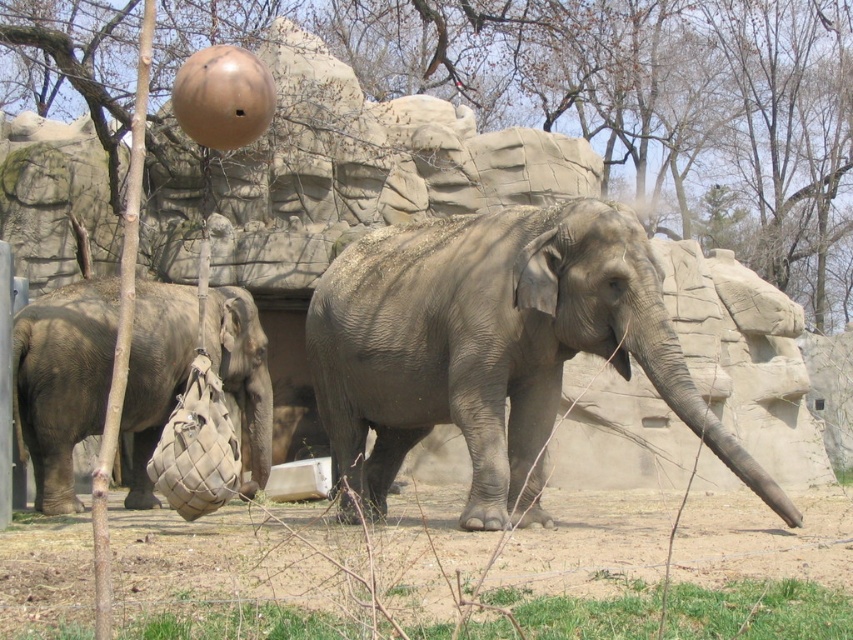
You are a zookeeper observing the elephants in their enclosure. You notice the gray matte elephant at center and the gray matte bag at left. Which object is positioned higher in the image?

The gray matte elephant at center is located above the gray matte bag at left, so it is positioned higher in the image.

You are a zookeeper standing at the origin point of the image coordinate system. You need to locate the gray matte elephant at center. What are its coordinates?

The gray matte elephant at center is located at coordinates point (491, 348).